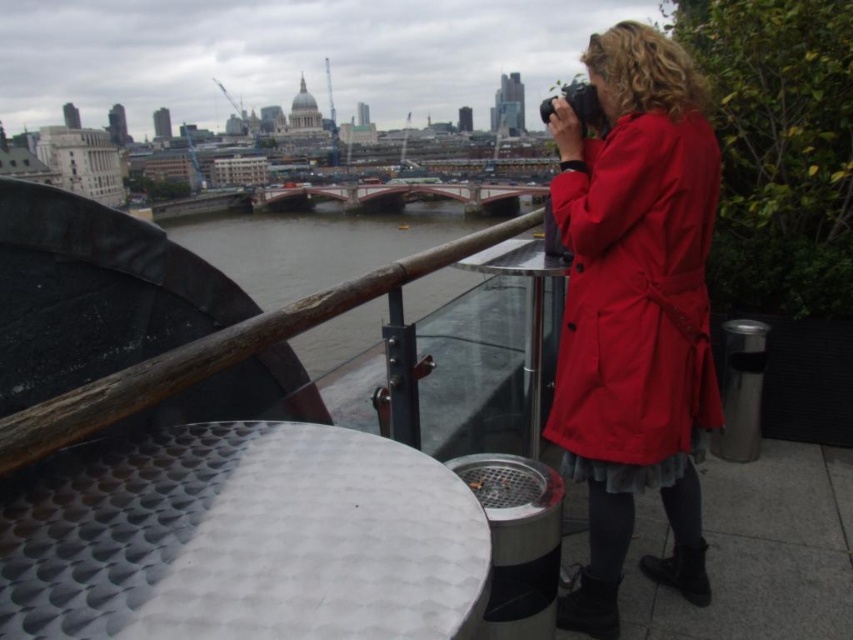
You are standing at the rooftop terrace and want to take a photo of the bridge in the background. The camera you are using has a focal length of 50mm. To ensure the brown wooden railing at upper center does not appear in the photo, how far back should you move from the current position?

The brown wooden railing at upper center is 36.03 meters away from the camera. To prevent it from appearing in the photo, you should move back so that the distance between you and the railing exceeds 36.03 meters.

You are standing on the terrace and want to take a photo of the brown wooden rail at upper left without the matte red coat at right blocking the view. Is the rail visible from your current position?

The brown wooden rail at upper left is behind the matte red coat at right, so it is not visible from your current position because the matte red coat at right is in front of it.

You are a photographer standing on the rooftop terrace. You notice the brown wooden railing at upper center and the brown wooden rail at upper left. Which one is wider?

The brown wooden railing at upper center is wider than the brown wooden rail at upper left.